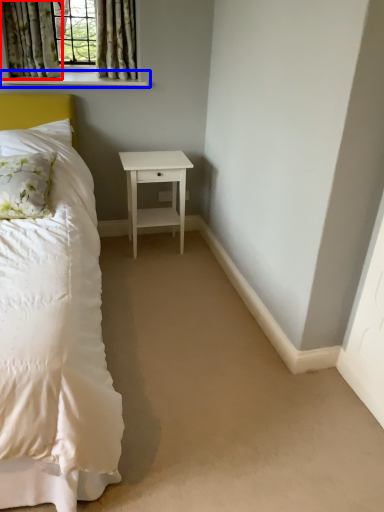
Question: Which object appears farthest to the camera in this image, curtain (highlighted by a red box) or window sill (highlighted by a blue box)?

Choices:
 (A) curtain
 (B) window sill

Answer: (B)